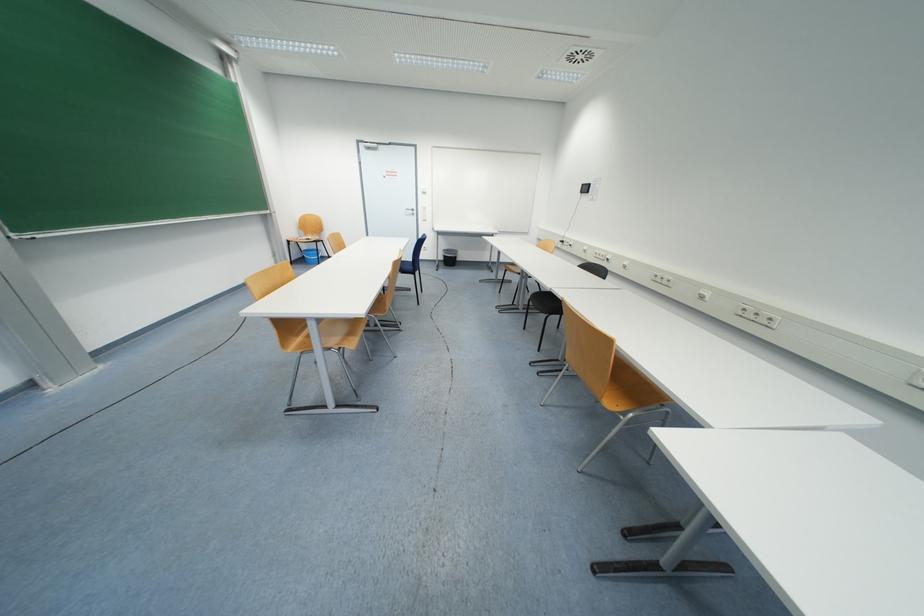
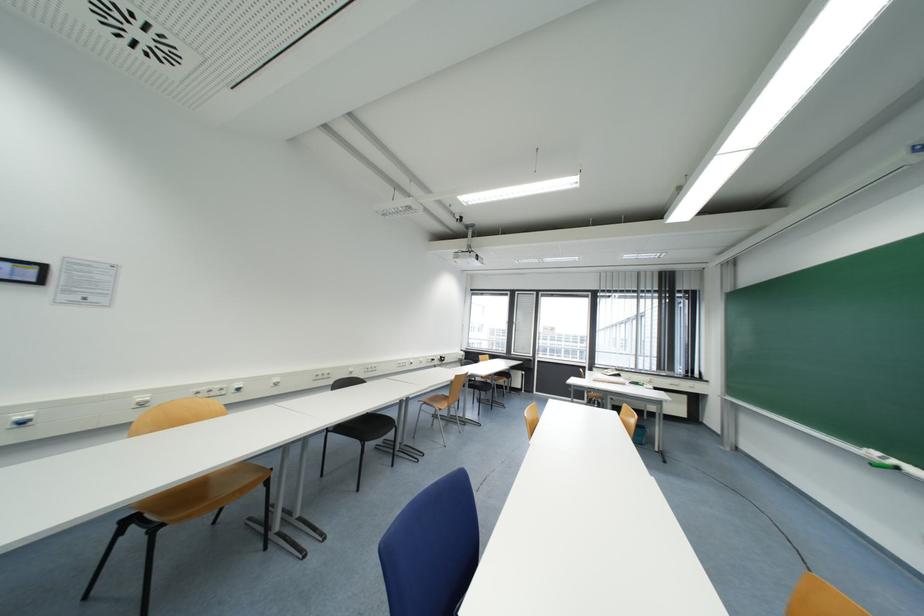
Question: I am providing you with two images of the same scene from different viewpoints. Please identify which objects are invisible in image2.

Choices:
 (A) yellow chair sitting surface
 (B) white power socket
 (C) black chair sitting surface
 (D) wooden door handle

Answer: (A)